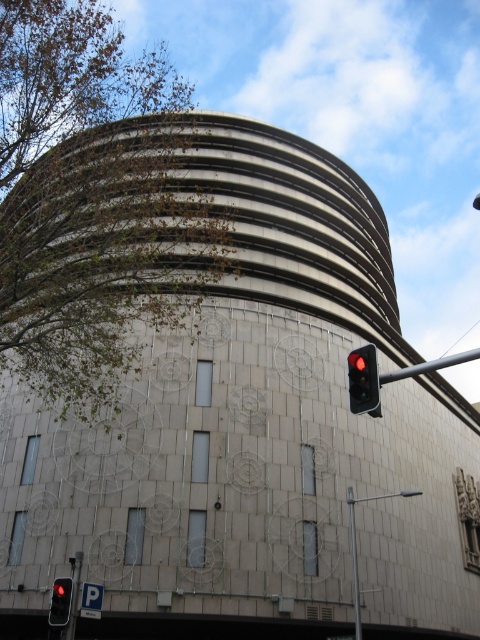
You are a city planner analyzing the space between two traffic lights. The red plastic traffic light at right and the red glass traffic light at lower left are both in view. Which traffic light takes up more visual space in the image?

The red glass traffic light at lower left takes up more visual space than the red plastic traffic light at right because it occupies more space in the image according to the description.

You are a city planner assessing the safety of the intersection near the metallic pole at right and the red glass traffic light at lower left. According to safety guidelines, traffic lights must be placed within 150 feet of their corresponding poles to ensure visibility. Does the current placement comply with these guidelines?

The distance between the metallic pole at right and the red glass traffic light at lower left is 170.72 feet, which exceeds the 150 feet guideline. Therefore, the placement does not comply with safety guidelines.